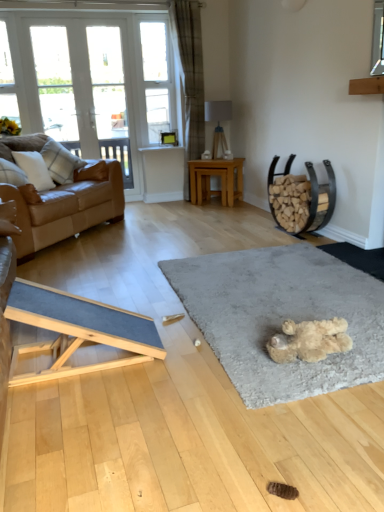
What is the approximate height of white fabric lampshade at upper center?

white fabric lampshade at upper center is 24.03 inches in height.

The height and width of the screenshot is (512, 384). I want to click on white plaid pillow at left, the first pillow viewed from the front, so click(34, 169).

Measure the distance between white textured pillow at left, the 1th pillow when ordered from back to front, and camera.

white textured pillow at left, the 1th pillow when ordered from back to front, and camera are 12.60 feet apart from each other.

What do you see at coordinates (215, 175) in the screenshot?
I see `light brown wooden table at center, the 2th table viewed from the front` at bounding box center [215, 175].

The image size is (384, 512). Describe the element at coordinates (77, 330) in the screenshot. I see `wooden ramp at lower left, the second table when ordered from top to bottom` at that location.

What is the approximate width of black rubber doormat at lower right?

It is 49.97 centimeters.

This screenshot has height=512, width=384. What are the coordinates of `black rubber doormat at lower right` in the screenshot? It's located at (358, 257).

Find the location of a particular element. The width and height of the screenshot is (384, 512). clear glass window screen at upper center is located at coordinates (157, 80).

The height and width of the screenshot is (512, 384). I want to click on white fabric lampshade at upper center, so click(218, 124).

Which object is positioned more to the right, white fabric lampshade at upper center or white glass window at upper left, the third window viewed from the right?

Positioned to the right is white fabric lampshade at upper center.

Is white fabric lampshade at upper center positioned beyond the bounds of white glass window at upper left, the 1th window positioned from the left?

Yes.

Consider the image. In the image, is white fabric lampshade at upper center positioned in front of or behind white glass window at upper left, the third window viewed from the right?

Clearly, white fabric lampshade at upper center is behind white glass window at upper left, the third window viewed from the right.

In the scene shown: Does white fabric lampshade at upper center have a lesser height compared to white glass window at upper left, the third window viewed from the right?

Yes, white fabric lampshade at upper center is shorter than white glass window at upper left, the third window viewed from the right.

Consider the image. From a real-world perspective, between white glass door at upper left, acting as the second window starting from the right, and soft gray carpet at center, who is vertically lower?

From a 3D spatial view, soft gray carpet at center is below.

From the image's perspective, which one is positioned lower, white glass door at upper left, marked as the second window in a left-to-right arrangement, or soft gray carpet at center?

From the image's view, soft gray carpet at center is below.

Does point (59, 88) lie behind point (292, 246)?

Yes, point (59, 88) is farther from viewer.

How distant is white glass door at upper left, marked as the second window in a left-to-right arrangement, from wooden ramp at lower left, the 1th table positioned from the front?

white glass door at upper left, marked as the second window in a left-to-right arrangement, is 13.90 feet from wooden ramp at lower left, the 1th table positioned from the front.

From a real-world perspective, is white glass door at upper left, acting as the second window starting from the right, physically above wooden ramp at lower left, the 1th table positioned from the front?

Yes, from a real-world perspective, white glass door at upper left, acting as the second window starting from the right, is on top of wooden ramp at lower left, the 1th table positioned from the front.

Consider the image. Which is less distant, (50, 105) or (77, 303)?

The point (77, 303) is in front.

Is white glass door at upper left, marked as the second window in a left-to-right arrangement, facing away from wooden ramp at lower left, the second table when ordered from top to bottom?

No, white glass door at upper left, marked as the second window in a left-to-right arrangement, is not facing the opposite direction of wooden ramp at lower left, the second table when ordered from top to bottom.

Is white glass door at upper left, arranged as the 1th window when viewed from the right, wider or thinner than white fabric lampshade at upper center?

Clearly, white glass door at upper left, arranged as the 1th window when viewed from the right, has less width compared to white fabric lampshade at upper center.

From the image's perspective, is white glass door at upper left, arranged as the 1th window when viewed from the right, on top of white fabric lampshade at upper center?

Yes, from the image's perspective, white glass door at upper left, arranged as the 1th window when viewed from the right, is above white fabric lampshade at upper center.

Which is in front, white glass door at upper left, acting as the 3th window starting from the left, or white fabric lampshade at upper center?

white glass door at upper left, acting as the 3th window starting from the left, is in front.

Does white glass window at upper left, the 1th window positioned from the left, have a larger size compared to light brown wooden table at center, which ranks as the 1th table in right-to-left order?

Incorrect, white glass window at upper left, the 1th window positioned from the left, is not larger than light brown wooden table at center, which ranks as the 1th table in right-to-left order.

Does point (18, 121) come in front of point (236, 172)?

No.

From the image's perspective, is white glass window at upper left, the 1th window positioned from the left, below light brown wooden table at center, which ranks as the 1th table in right-to-left order?

No.

Measure the distance from white glass door at upper left, acting as the second window starting from the right, to clear glass window screen at upper center.

white glass door at upper left, acting as the second window starting from the right, and clear glass window screen at upper center are 1.11 meters apart from each other.

Considering the relative positions of white glass door at upper left, acting as the second window starting from the right, and clear glass window screen at upper center in the image provided, is white glass door at upper left, acting as the second window starting from the right, in front of clear glass window screen at upper center?

Yes.

Is white glass door at upper left, marked as the second window in a left-to-right arrangement, oriented towards clear glass window screen at upper center?

No, white glass door at upper left, marked as the second window in a left-to-right arrangement, is not turned towards clear glass window screen at upper center.

Between white glass door at upper left, acting as the second window starting from the right, and clear glass window screen at upper center, which one has more height?

white glass door at upper left, acting as the second window starting from the right, is taller.

Is point (24, 156) positioned after point (77, 165)?

No, it is not.

Is white plaid pillow at left, the second pillow from the back, to the right of white textured pillow at left, the 2th pillow viewed from the front, from the viewer's perspective?

In fact, white plaid pillow at left, the second pillow from the back, is to the left of white textured pillow at left, the 2th pillow viewed from the front.

Is white plaid pillow at left, the second pillow from the back, next to white textured pillow at left, the 1th pillow when ordered from back to front?

There is a gap between white plaid pillow at left, the second pillow from the back, and white textured pillow at left, the 1th pillow when ordered from back to front.

How different are the orientations of white plaid pillow at left, the second pillow from the back, and white textured pillow at left, the 1th pillow when ordered from back to front, in degrees?

The facing directions of white plaid pillow at left, the second pillow from the back, and white textured pillow at left, the 1th pillow when ordered from back to front, are 8.5e-05 degrees apart.

The width and height of the screenshot is (384, 512). Find the location of `lamp below the white glass window at upper left, the 1th window positioned from the left (from the image's perspective)`. lamp below the white glass window at upper left, the 1th window positioned from the left (from the image's perspective) is located at coordinates (218, 124).

I want to click on mat located on the right of white glass door at upper left, acting as the second window starting from the right, so click(281, 317).

Which object lies further to the anchor point white textured pillow at left, the 1th pillow when ordered from back to front, white plaid pillow at left, the second pillow from the back, or white fabric lampshade at upper center?

Based on the image, white fabric lampshade at upper center appears to be further to white textured pillow at left, the 1th pillow when ordered from back to front.

Looking at this image, estimate the real-world distances between objects in this image. Which object is further from soft gray carpet at center, light brown wooden table at center, the 1th table viewed from the top, or white glass window at upper left, the third window viewed from the right?

white glass window at upper left, the third window viewed from the right, is further to soft gray carpet at center.

Estimate the real-world distances between objects in this image. Which object is further from white plaid pillow at left, the second pillow from the back, white glass door at upper left, acting as the 3th window starting from the left, or white glass screen door at upper left?

The object further to white plaid pillow at left, the second pillow from the back, is white glass screen door at upper left.

Looking at the image, which one is located further to white plaid pillow at left, the first pillow viewed from the front, tan leather couch at left or black rubber doormat at lower right?

black rubber doormat at lower right is positioned further to the anchor white plaid pillow at left, the first pillow viewed from the front.

From the image, which object appears to be farther from white textured pillow at left, the 2th pillow viewed from the front, clear glass window screen at upper center or white glass screen door at upper left?

Among the two, clear glass window screen at upper center is located further to white textured pillow at left, the 2th pillow viewed from the front.

Consider the image. From the image, which object appears to be nearer to soft gray carpet at center, white plaid pillow at left, the first pillow viewed from the front, or white glass screen door at upper left?

white plaid pillow at left, the first pillow viewed from the front, is positioned closer to the anchor soft gray carpet at center.

Considering their positions, is soft gray carpet at center positioned closer to white glass window at upper left, the third window viewed from the right, than white glass door at upper left, marked as the second window in a left-to-right arrangement?

white glass door at upper left, marked as the second window in a left-to-right arrangement, is positioned closer to the anchor white glass window at upper left, the third window viewed from the right.

Based on their spatial positions, is light brown wooden table at center, which ranks as the 1th table in right-to-left order, or white plaid pillow at left, the second pillow from the back, closer to white glass screen door at upper left?

Among the two, light brown wooden table at center, which ranks as the 1th table in right-to-left order, is located nearer to white glass screen door at upper left.

Locate an element on the screen. screen door between tan leather couch at left and clear glass window screen at upper center in the front-back direction is located at coordinates (110, 97).

Find the location of a particular element. This screenshot has width=384, height=512. window screen between white glass door at upper left, marked as the second window in a left-to-right arrangement, and white fabric lampshade at upper center, in the horizontal direction is located at coordinates (157, 80).

Find the location of a particular element. The image size is (384, 512). studio couch between soft gray carpet at center and white textured pillow at left, the 2th pillow viewed from the front, from front to back is located at coordinates (66, 204).

You are a GUI agent. You are given a task and a screenshot of the screen. Output one action in this format:
    pyautogui.click(x=<x>, y=<y>)
    Task: Click on the pillow between tan leather couch at left and white textured pillow at left, the 1th pillow when ordered from back to front, from front to back
    
    Given the screenshot: What is the action you would take?
    pyautogui.click(x=34, y=169)